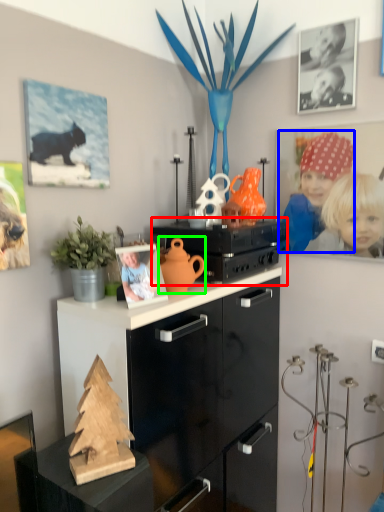
Question: Based on their relative distances, which object is farther from appliance (highlighted by a red box)? Choose from person (highlighted by a blue box) and toy (highlighted by a green box).

Choices:
 (A) person
 (B) toy

Answer: (A)